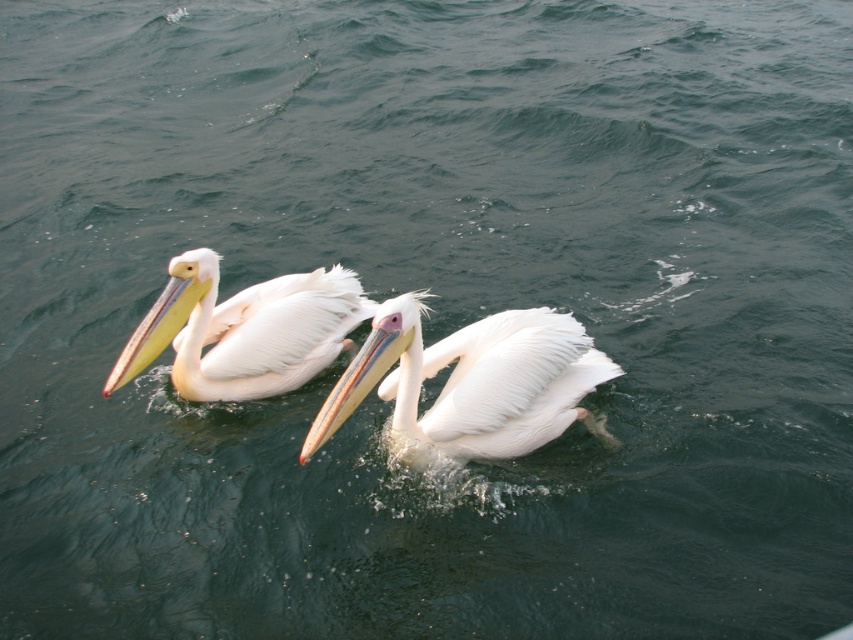
Is white feathered pelican at center below white matte pelican at left?

Correct, white feathered pelican at center is located below white matte pelican at left.

Between white feathered pelican at center and white matte pelican at left, which one is positioned lower?

white feathered pelican at center

Who is more forward, (547, 339) or (254, 353)?

Point (547, 339) is more forward.

Find the location of a particular element. Image resolution: width=853 pixels, height=640 pixels. white feathered pelican at center is located at coordinates (473, 381).